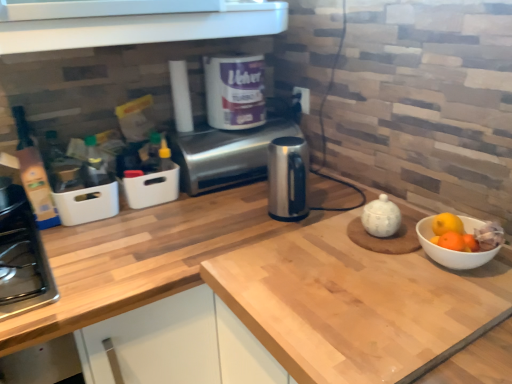
Question: Considering the relative sizes of light wood countertop at center and black plastic electric outlet at upper center in the image provided, is light wood countertop at center shorter than black plastic electric outlet at upper center?

Choices:
 (A) yes
 (B) no

Answer: (B)

Question: Considering the relative positions of light wood countertop at center and black plastic electric outlet at upper center in the image provided, is light wood countertop at center to the left of black plastic electric outlet at upper center from the viewer's perspective?

Choices:
 (A) yes
 (B) no

Answer: (A)

Question: Can you confirm if light wood countertop at center is bigger than black plastic electric outlet at upper center?

Choices:
 (A) yes
 (B) no

Answer: (A)

Question: From the image's perspective, is light wood countertop at center located beneath black plastic electric outlet at upper center?

Choices:
 (A) no
 (B) yes

Answer: (B)

Question: Is light wood countertop at center far from black plastic electric outlet at upper center?

Choices:
 (A) yes
 (B) no

Answer: (B)

Question: Does light wood countertop at center have a greater height compared to black plastic electric outlet at upper center?

Choices:
 (A) no
 (B) yes

Answer: (B)

Question: Is satin silver toaster at center looking in the opposite direction of white glossy tea pot at center-right?

Choices:
 (A) yes
 (B) no

Answer: (B)

Question: Considering the relative sizes of satin silver toaster at center and white glossy tea pot at center-right in the image provided, is satin silver toaster at center smaller than white glossy tea pot at center-right?

Choices:
 (A) yes
 (B) no

Answer: (B)

Question: Is satin silver toaster at center facing towards white glossy tea pot at center-right?

Choices:
 (A) no
 (B) yes

Answer: (B)

Question: From a real-world perspective, is satin silver toaster at center under white glossy tea pot at center-right?

Choices:
 (A) no
 (B) yes

Answer: (A)

Question: Would you say satin silver toaster at center is a long distance from white glossy tea pot at center-right?

Choices:
 (A) yes
 (B) no

Answer: (B)

Question: Does satin silver toaster at center have a greater width compared to white glossy tea pot at center-right?

Choices:
 (A) yes
 (B) no

Answer: (A)

Question: From a real-world perspective, is light wood countertop at center physically above satin silver toaster at center?

Choices:
 (A) yes
 (B) no

Answer: (B)